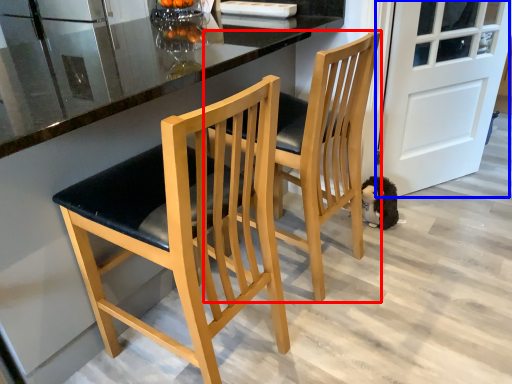
Question: Among these objects, which one is nearest to the camera, chair (highlighted by a red box) or door (highlighted by a blue box)?

Choices:
 (A) chair
 (B) door

Answer: (A)